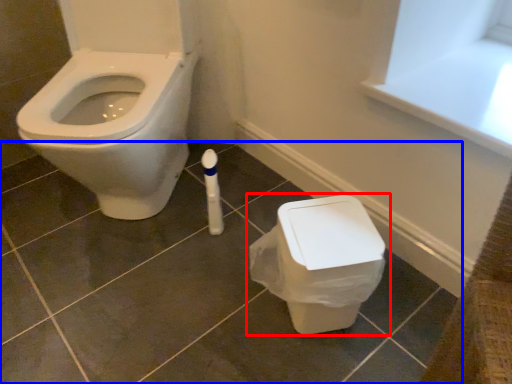
Question: Which point is further to the camera, toilet (highlighted by a red box) or tile (highlighted by a blue box)?

Choices:
 (A) toilet
 (B) tile

Answer: (A)